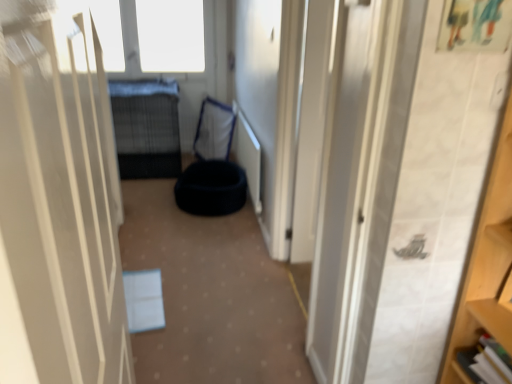
Question: Is black wire mesh bed at center taller or shorter than black fabric bean bag at center, the 2th bean bag chair positioned from the front?

Choices:
 (A) tall
 (B) short

Answer: (B)

Question: From the image's perspective, is black wire mesh bed at center above or below black fabric bean bag at center, the 1th bean bag chair in the back-to-front sequence?

Choices:
 (A) below
 (B) above

Answer: (B)

Question: Based on their relative distances, which object is nearer to the blue fabric pet bed at center?

Choices:
 (A) black fabric bean bag at center, the 1th bean bag chair positioned from the front
 (B) black wire mesh bed at center
 (C) white matte door at center
 (D) black fabric bean bag at center, the 1th bean bag chair in the back-to-front sequence

Answer: (A)

Question: Estimate the real-world distances between objects in this image. Which object is closer to the blue fabric pet bed at center?

Choices:
 (A) black fabric bean bag at center, arranged as the second bean bag chair when viewed from the back
 (B) black fabric bean bag at center, the 1th bean bag chair in the back-to-front sequence
 (C) black wire mesh bed at center
 (D) white matte door at center

Answer: (A)